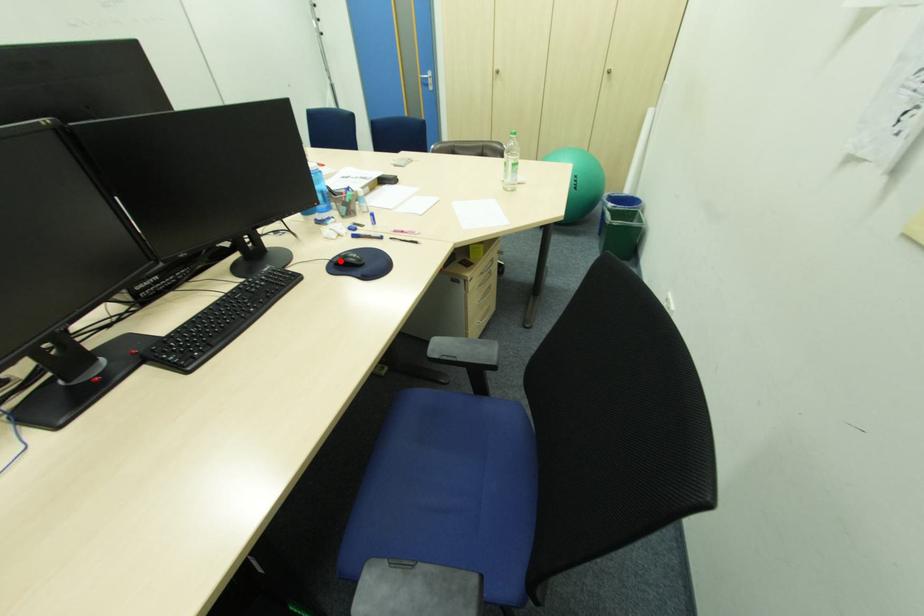
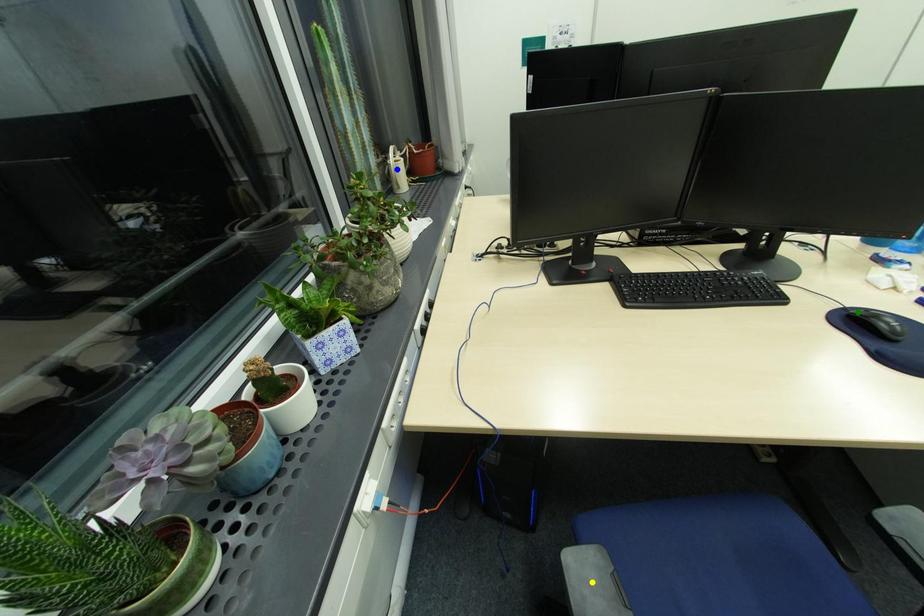
Question: I am providing you with two images of the same scene from different viewpoints. A red point is marked on the first image. You are given multiple points on the second image. Can you choose the point in image 2 that corresponds to the point in image 1?

Choices:
 (A) green point
 (B) blue point
 (C) yellow point

Answer: (A)